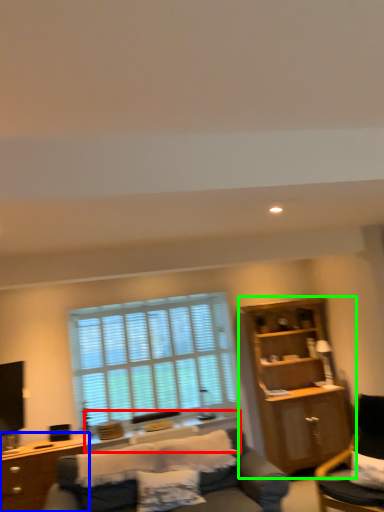
Question: Which object is positioned farthest from side table (highlighted by a red box)? Select from desk (highlighted by a blue box) and cabinetry (highlighted by a green box).

Choices:
 (A) desk
 (B) cabinetry

Answer: (B)